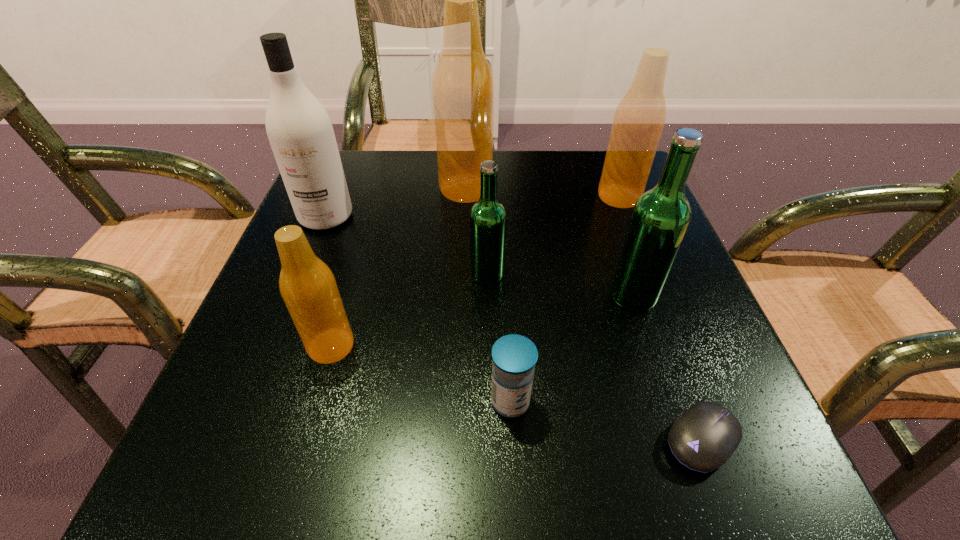
Locate which object ranks fifth in proximity to the second biggest tan beer bottle. Please provide its 2D coordinates. Your answer should be formatted as a tuple, i.e. [(x, y)], where the tuple contains the x and y coordinates of a point satisfying the conditions above.

[(514, 357)]

Locate which object is the second closest to the seventh tallest object. Please provide its 2D coordinates. Your answer should be formatted as a tuple, i.e. [(x, y)], where the tuple contains the x and y coordinates of a point satisfying the conditions above.

[(488, 219)]

Identify the location of beer bottle that stands as the second closest to the white shampoo. This screenshot has height=540, width=960. (308, 287).

Locate an element on the screen. Image resolution: width=960 pixels, height=540 pixels. beer bottle that stands as the second closest to the right green beer bottle is located at coordinates (639, 119).

Identify which tan beer bottle is the closest to the biggest tan beer bottle. Please provide its 2D coordinates. Your answer should be formatted as a tuple, i.e. [(x, y)], where the tuple contains the x and y coordinates of a point satisfying the conditions above.

[(639, 119)]

Locate an element on the screen. The image size is (960, 540). tan beer bottle that is the second closest one to the second smallest tan beer bottle is located at coordinates 308,287.

Find the location of `vacant space that satisfies the following two spatial constraints: 1. on the front side of the left green beer bottle; 2. on the right side of the right green beer bottle`. vacant space that satisfies the following two spatial constraints: 1. on the front side of the left green beer bottle; 2. on the right side of the right green beer bottle is located at coordinates (488, 295).

Image resolution: width=960 pixels, height=540 pixels. In order to click on blank area in the image that satisfies the following two spatial constraints: 1. on the front side of the leftmost beer bottle; 2. on the right side of the computer mouse in this screenshot , I will do `click(304, 440)`.

At what (x,y) coordinates should I click in order to perform the action: click on vacant area that satisfies the following two spatial constraints: 1. on the back side of the black computer mouse; 2. on the left side of the rightmost tan beer bottle. Please return your answer as a coordinate pair (x, y). Image resolution: width=960 pixels, height=540 pixels. Looking at the image, I should click on (612, 197).

You are a GUI agent. You are given a task and a screenshot of the screen. Output one action in this format:
    pyautogui.click(x=<x>, y=<y>)
    Task: Click on the free region that satisfies the following two spatial constraints: 1. on the front side of the biggest tan beer bottle; 2. on the right side of the shortest object
    The height and width of the screenshot is (540, 960).
    Given the screenshot: What is the action you would take?
    pyautogui.click(x=456, y=440)